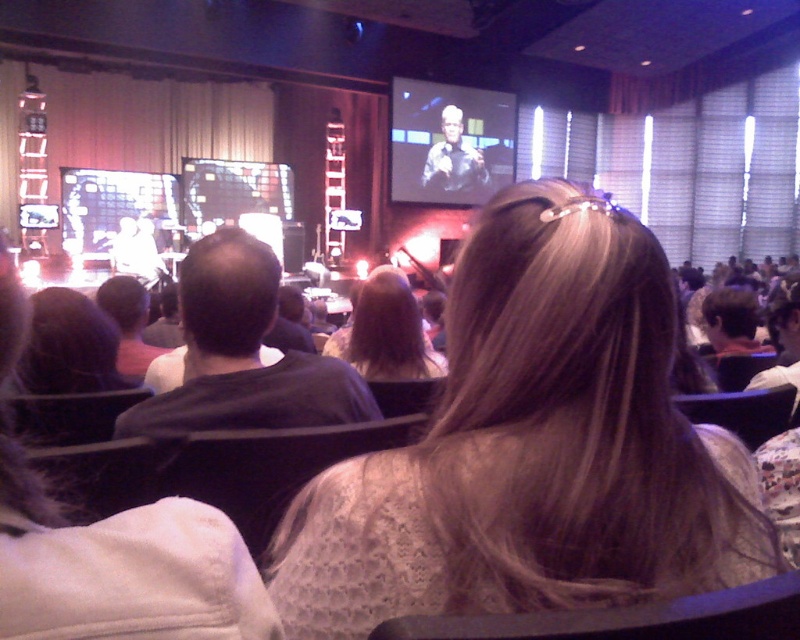
Question: Does black cotton shirt at left appear on the left side of light brown hair at center?

Choices:
 (A) no
 (B) yes

Answer: (B)

Question: Which object is closer to the camera taking this photo?

Choices:
 (A) black cotton shirt at left
 (B) light brown hair at center

Answer: (A)

Question: Which object is closer to the camera taking this photo?

Choices:
 (A) white lace dress at center
 (B) light brown hair at center
 (C) black cotton shirt at left

Answer: (A)

Question: Does white lace dress at center have a greater width compared to black cotton shirt at left?

Choices:
 (A) yes
 (B) no

Answer: (A)

Question: Based on their relative distances, which object is farther from the black cotton shirt at left?

Choices:
 (A) light brown hair at center
 (B) white lace dress at center

Answer: (A)

Question: Does white lace dress at center lie in front of light brown hair at center?

Choices:
 (A) no
 (B) yes

Answer: (B)